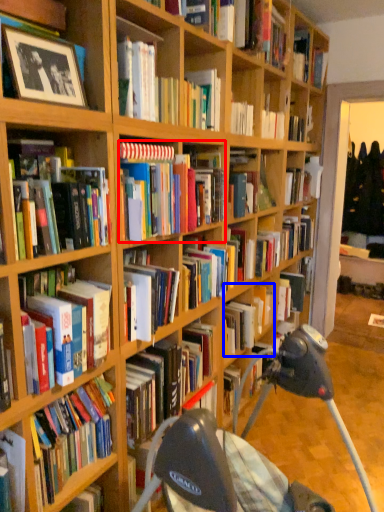
Question: Which point is closer to the camera, book (highlighted by a red box) or book (highlighted by a blue box)?

Choices:
 (A) book
 (B) book

Answer: (A)